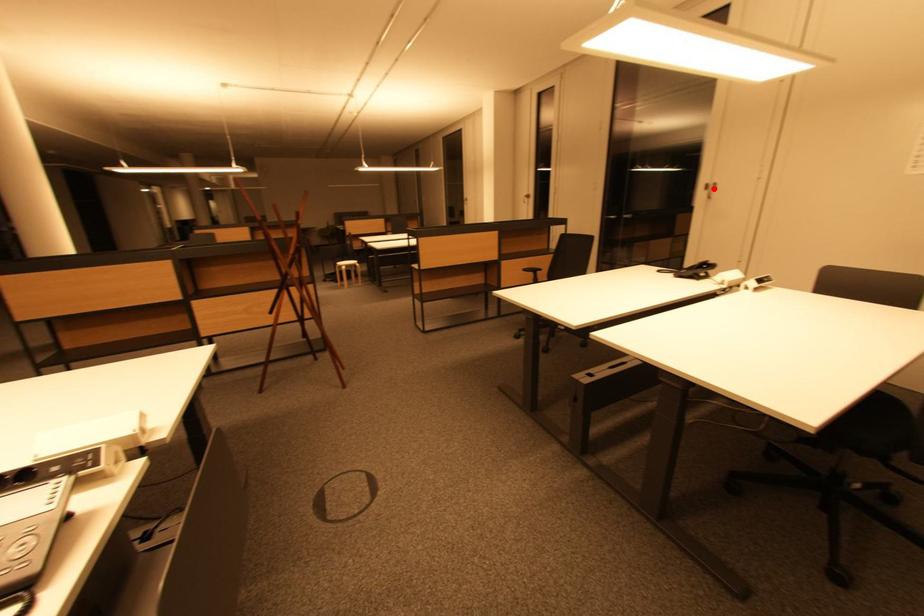
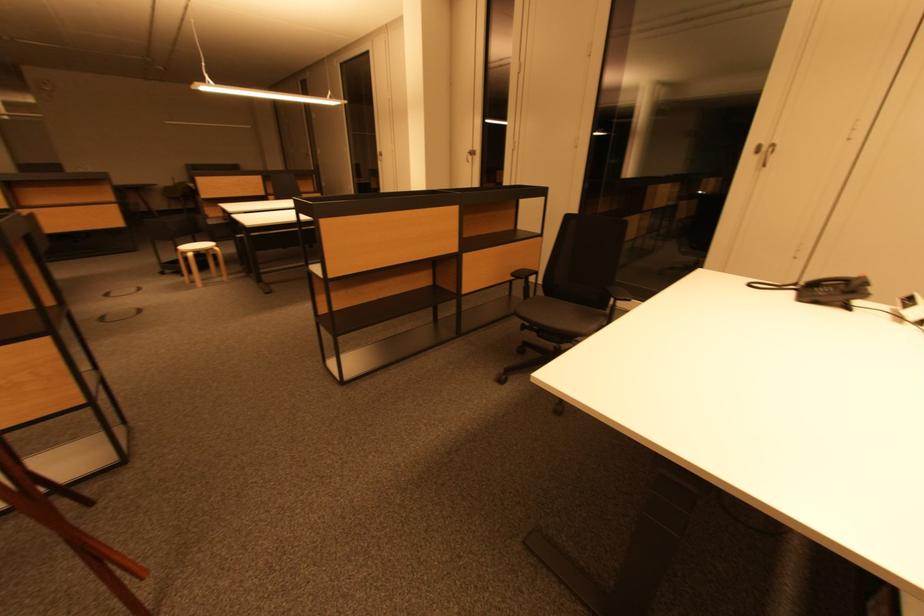
Locate, in the second image, the point that corresponds to the highlighted location in the first image.

(767, 150)